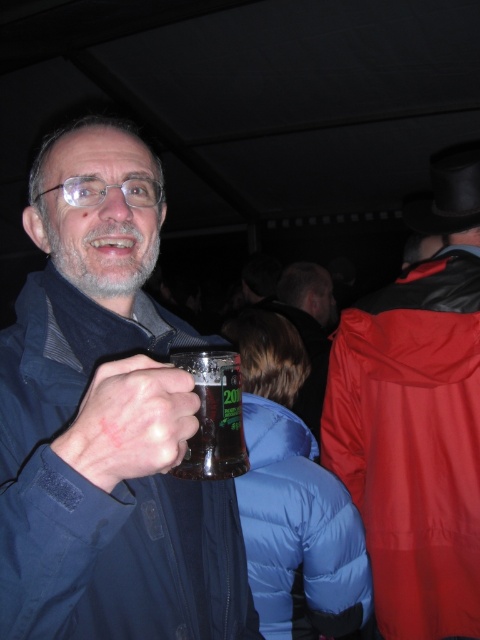
Can you confirm if matte glass mug at center is wider than matte black jacket at center?

No, matte glass mug at center is not wider than matte black jacket at center.

Which is behind, point (149, 404) or point (312, 268)?

The point (312, 268) is behind.

This screenshot has height=640, width=480. Identify the location of matte glass mug at center. (107, 420).

Which is more to the left, blue puffy jacket at lower center or matte black jacket at center?

blue puffy jacket at lower center is more to the left.

In the scene shown: Is the position of blue puffy jacket at lower center less distant than that of matte black jacket at center?

That is True.

Identify the location of blue puffy jacket at lower center. (299, 531).

Which is more to the left, red matte jacket at upper right or matte plastic mug at center?

Positioned to the left is matte plastic mug at center.

Does red matte jacket at upper right have a lesser height compared to matte plastic mug at center?

In fact, red matte jacket at upper right may be taller than matte plastic mug at center.

The image size is (480, 640). Identify the location of red matte jacket at upper right. (418, 417).

Find the location of a particular element. This screenshot has width=480, height=640. red matte jacket at upper right is located at coordinates (418, 417).